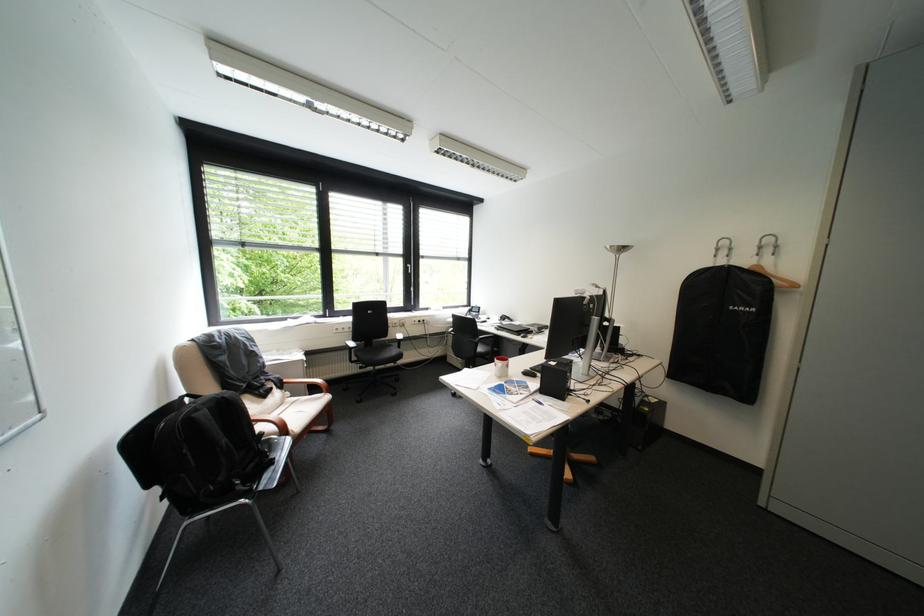
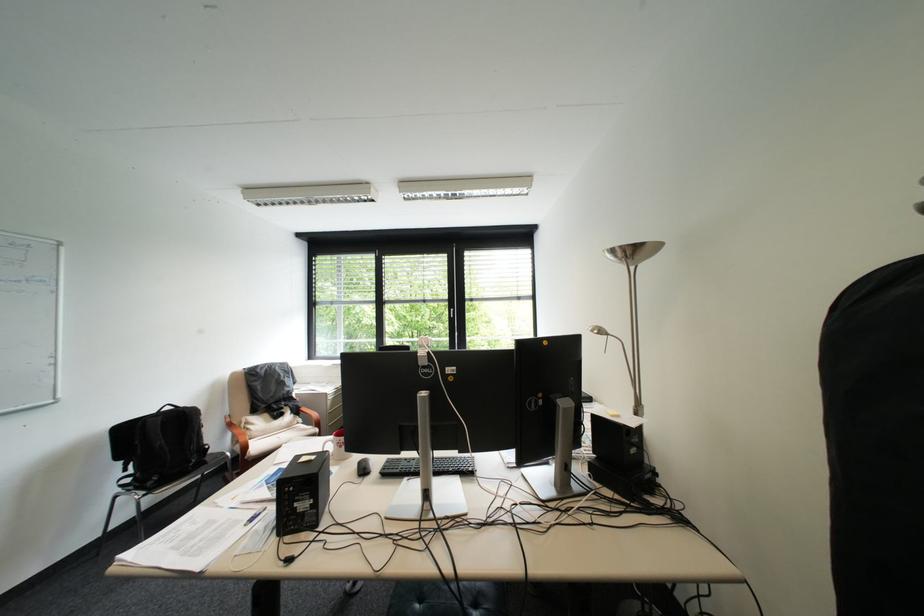
Where in the second image is the point corresponding to point 236,398 from the first image?

(198, 411)